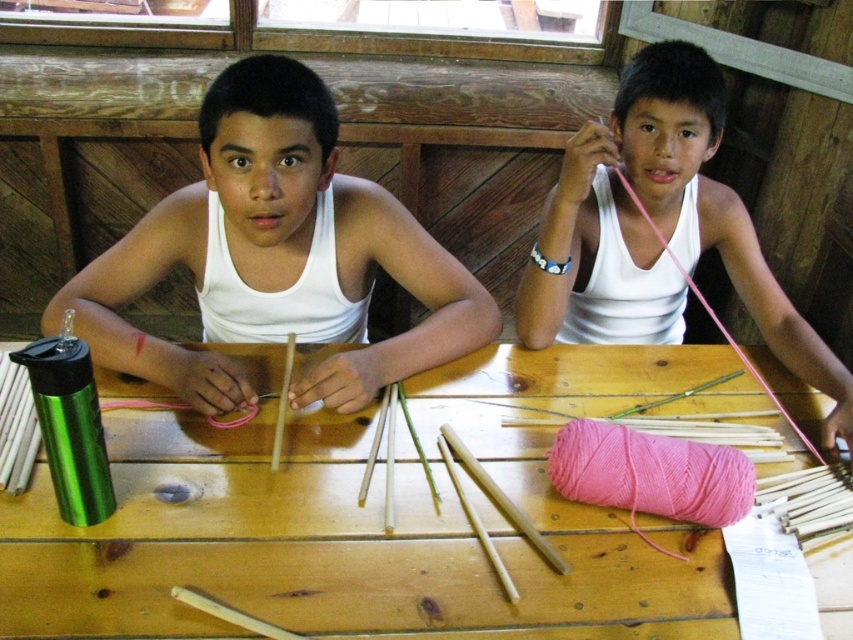
Question: Which point is closer to the camera taking this photo?

Choices:
 (A) pos(627,602)
 (B) pos(726,474)
 (C) pos(271,157)

Answer: (A)

Question: Estimate the real-world distances between objects in this image. Which object is closer to the wooden table at center?

Choices:
 (A) pink matte yarn at upper right
 (B) pink yarn at lower center
 (C) white matte tank top at center

Answer: (B)

Question: Which object appears closest to the camera in this image?

Choices:
 (A) pink yarn at lower center
 (B) white matte tank top at center
 (C) wooden table at center

Answer: (C)

Question: Does white matte tank top at center appear over pink yarn at lower center?

Choices:
 (A) yes
 (B) no

Answer: (A)

Question: Does wooden table at center appear on the left side of pink matte yarn at upper right?

Choices:
 (A) no
 (B) yes

Answer: (B)

Question: Can you confirm if wooden table at center is positioned to the left of white matte tank top at center?

Choices:
 (A) yes
 (B) no

Answer: (B)